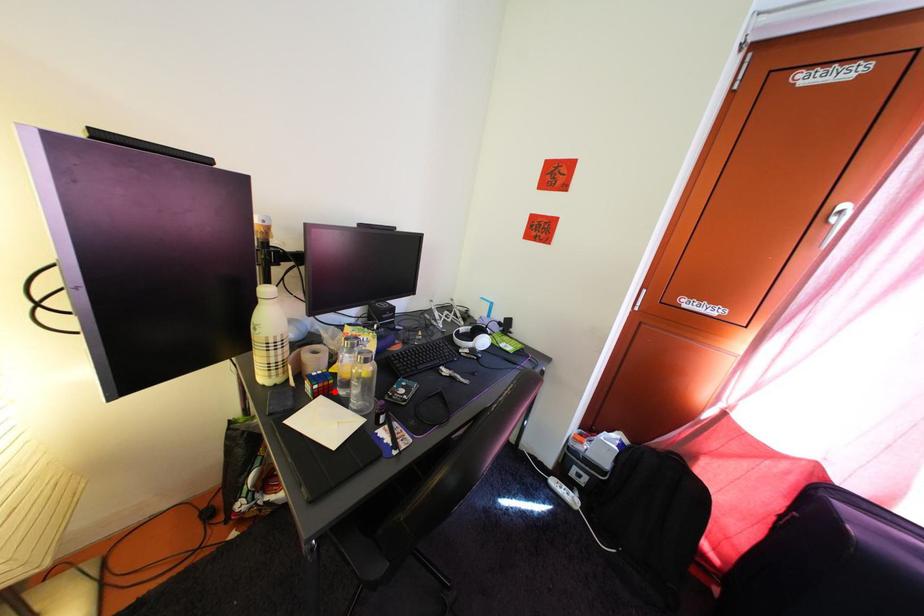
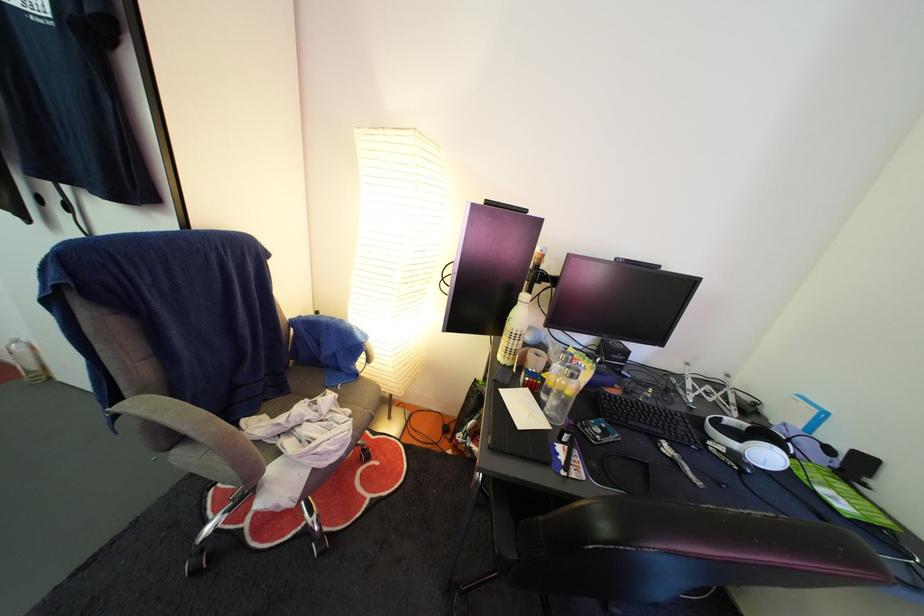
Question: A red point is marked in image1. In image2, is the corresponding 3D point closer to the camera or farther? Reply with the corresponding letter.

Choices:
 (A) The corresponding 3D point is closer.
 (B) The corresponding 3D point is farther.

Answer: (A)